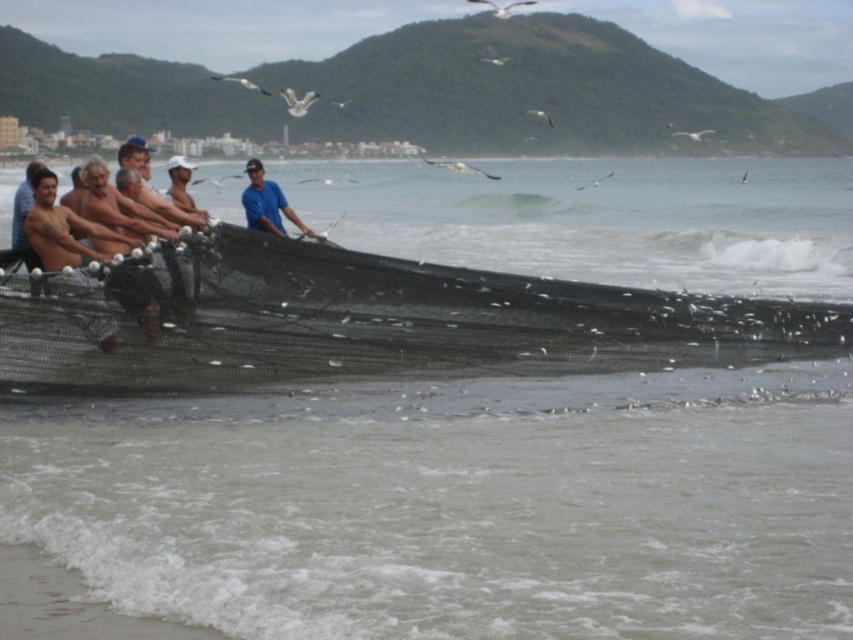
You are a photographer taking pictures of the fishing scene. You notice two people in the foreground. One has a smooth skin torso at left and the other has a blue matte shirt at center. Which person appears smaller in your photo?

The smooth skin torso at left appears smaller in the photo because it has a smaller size compared to the blue matte shirt at center.

You are a photographer at the beach scene. You want to capture a photo that includes both the black mesh net at center and the smooth skin torso at left. Given that your camera has a limited field of view, which object should you position closer to the camera to ensure both are in frame without cropping?

Since the black mesh net at center is smaller than the smooth skin torso at left, you should position the black mesh net at center closer to the camera to ensure both objects fit within the frame.

You are standing at the center of the beach scene. There is a point marked at coordinates (361,321). Based on the scene description, can you determine what object this point is located on?

The point is located on the black mesh net at center.